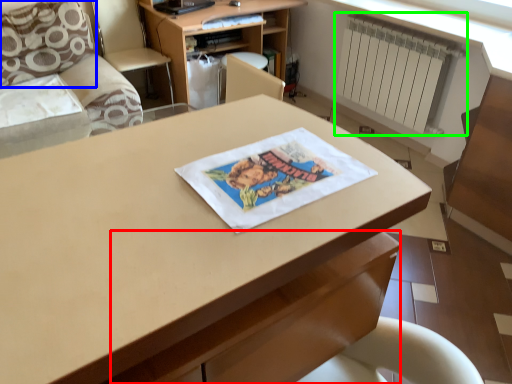
Question: Which is farther away from drawer (highlighted by a red box)? pillow (highlighted by a blue box) or radiator (highlighted by a green box)?

Choices:
 (A) pillow
 (B) radiator

Answer: (A)